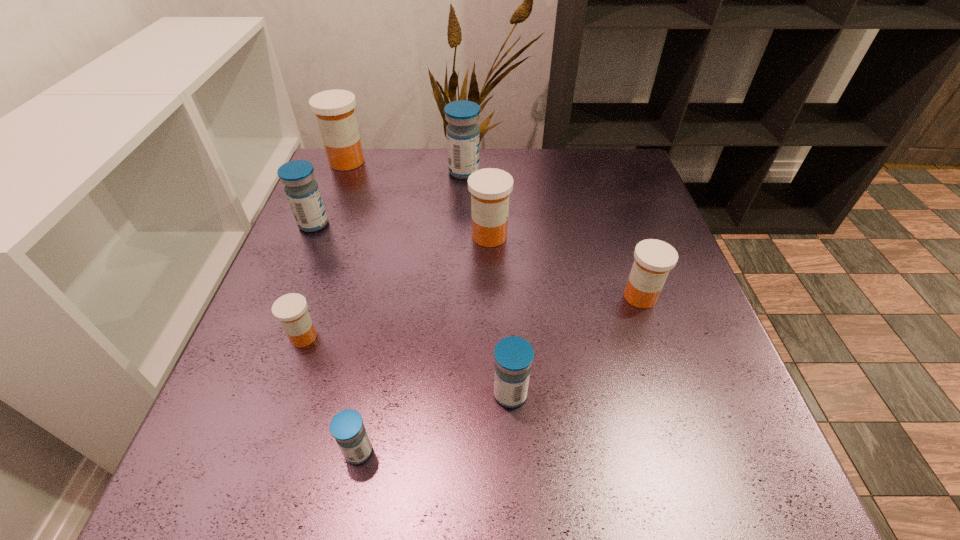
Image resolution: width=960 pixels, height=540 pixels. In order to click on free region at the right edge of the desktop in this screenshot , I will do [x=703, y=318].

In the image, there is a desktop. Where is `vacant space at the far left corner`? The image size is (960, 540). vacant space at the far left corner is located at coordinates (333, 184).

In order to click on vacant space at the far right corner in this screenshot , I will do `click(608, 190)`.

The image size is (960, 540). I want to click on vacant space at the near right corner of the desktop, so click(x=731, y=476).

Identify the location of unoccupied position between the seventh farthest object and the third nearest medicine. (407, 366).

Image resolution: width=960 pixels, height=540 pixels. What are the coordinates of `free space between the second orange medicine from right to left and the nearest orange medicine` in the screenshot? It's located at (396, 286).

Image resolution: width=960 pixels, height=540 pixels. What are the coordinates of `vacant point located between the third nearest object and the farthest orange medicine` in the screenshot? It's located at (325, 249).

I want to click on vacant area between the third smallest orange medicine and the leftmost blue medicine, so click(x=401, y=230).

Where is `vacant area that lies between the farthest orange medicine and the third blue medicine from left to right`? vacant area that lies between the farthest orange medicine and the third blue medicine from left to right is located at coordinates (405, 167).

Locate an element on the screen. The width and height of the screenshot is (960, 540). free space that is in between the leftmost blue medicine and the smallest orange medicine is located at coordinates (308, 280).